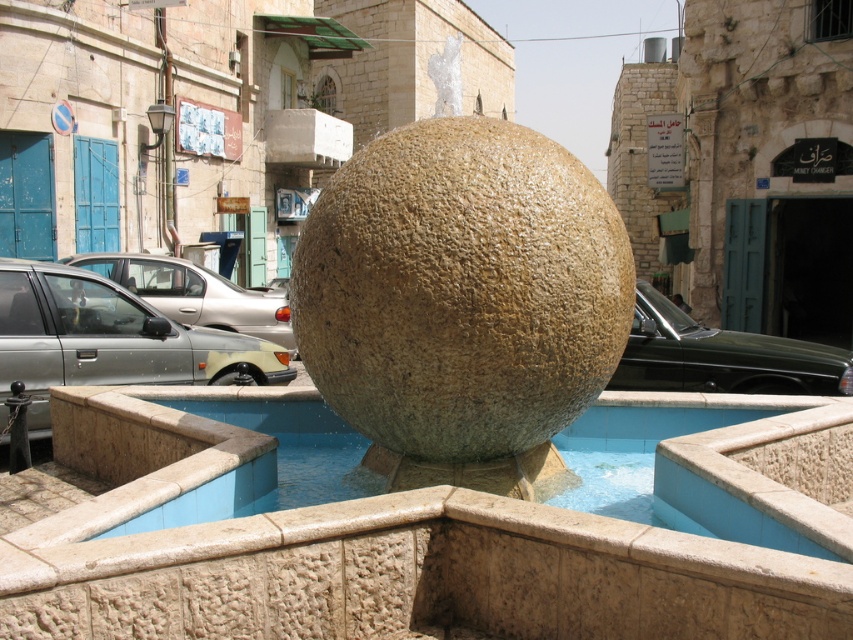
Who is more forward, (579, 257) or (33, 332)?

Positioned in front is point (579, 257).

Is granite sphere at center positioned in front of silver metallic car at center?

Yes, granite sphere at center is in front of silver metallic car at center.

Measure the distance between granite sphere at center and camera.

They are 4.28 meters apart.

Locate an element on the screen. granite sphere at center is located at coordinates (462, 301).

In the scene shown: Can you confirm if silver metallic car at center is wider than silver metallic car at left?

No, silver metallic car at center is not wider than silver metallic car at left.

Locate an element on the screen. silver metallic car at center is located at coordinates (109, 340).

What are the coordinates of `silver metallic car at center` in the screenshot? It's located at (109, 340).

How distant is blue stone pool at center from silver metallic car at center?

blue stone pool at center is 5.23 meters away from silver metallic car at center.

Does blue stone pool at center appear under silver metallic car at center?

Yes, blue stone pool at center is below silver metallic car at center.

Is point (688, 396) positioned after point (22, 276)?

No.

This screenshot has width=853, height=640. I want to click on blue stone pool at center, so click(x=737, y=464).